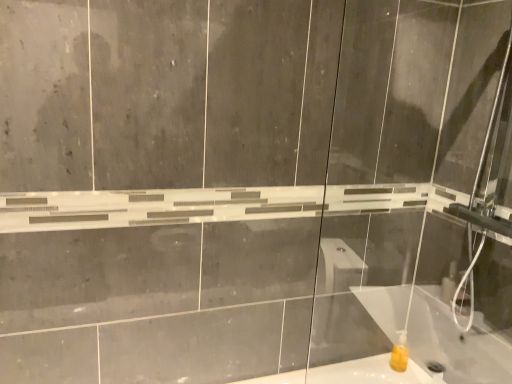
Locate an element on the screen. The width and height of the screenshot is (512, 384). transparent glass shower door at right is located at coordinates (413, 193).

What do you see at coordinates (413, 193) in the screenshot?
I see `transparent glass shower door at right` at bounding box center [413, 193].

This screenshot has width=512, height=384. I want to click on transparent glass shower door at right, so click(x=413, y=193).